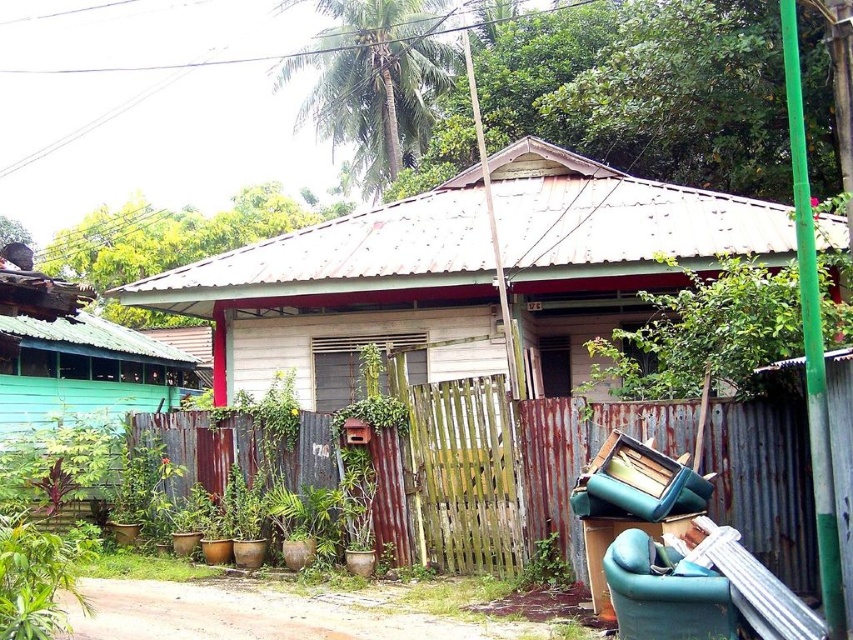
Question: Which object is farther from the camera taking this photo?

Choices:
 (A) wooden hut at center
 (B) green fabric armchair at lower right

Answer: (A)

Question: Which point is farther from the camera taking this photo?

Choices:
 (A) (380, 499)
 (B) (340, 368)
 (C) (608, 593)

Answer: (B)

Question: Among these points, which one is nearest to the camera?

Choices:
 (A) [525, 456]
 (B) [276, 278]

Answer: (A)

Question: Is rusty metal fence at center closer to the viewer compared to green fabric armchair at lower right?

Choices:
 (A) yes
 (B) no

Answer: (B)

Question: Does rusty metal fence at center lie behind green fabric armchair at lower right?

Choices:
 (A) yes
 (B) no

Answer: (A)

Question: Observing the image, what is the correct spatial positioning of wooden hut at center in reference to rusty metal fence at center?

Choices:
 (A) right
 (B) left

Answer: (A)